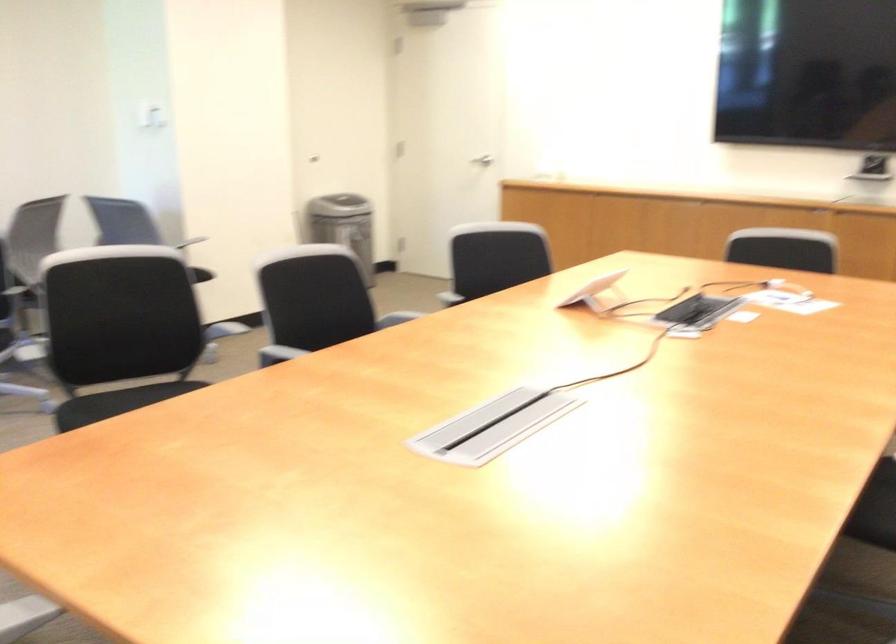
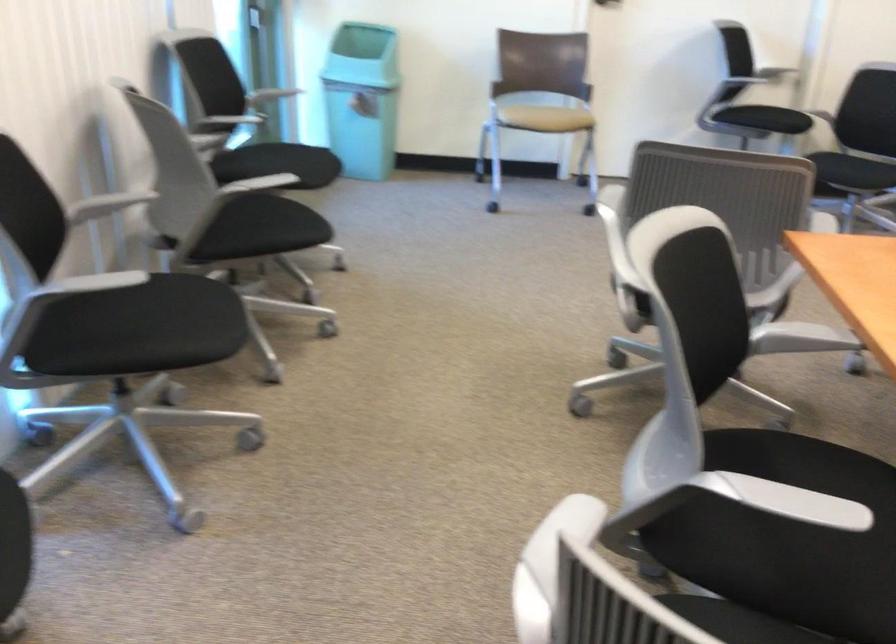
The first image is from the beginning of the video and the second image is from the end. How did the camera likely rotate when shooting the video?

The camera's rotation is toward left-down.